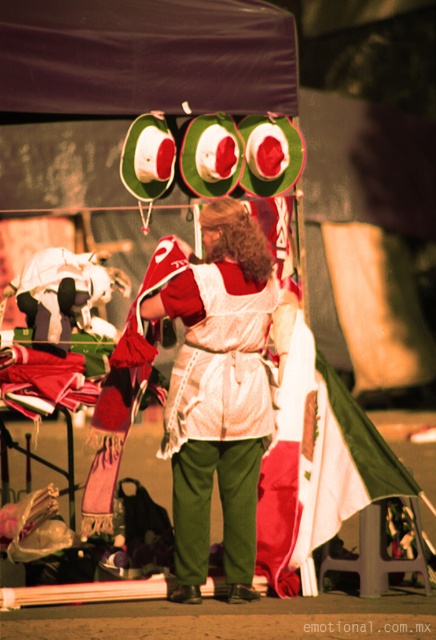
Between point (46, 10) and point (245, 518), which one is positioned behind?

The point (245, 518) is behind.

At what (x,y) coordinates should I click in order to perform the action: click on black fabric canopy at upper center. Please return your answer as a coordinate pair (x, y). Image resolution: width=436 pixels, height=640 pixels. Looking at the image, I should click on (146, 56).

Between point (19, 16) and point (230, 563), which one is positioned in front?

Point (19, 16) is more forward.

You are a GUI agent. You are given a task and a screenshot of the screen. Output one action in this format:
    pyautogui.click(x=<x>, y=<y>)
    Task: Click on the black fabric canopy at upper center
    The height and width of the screenshot is (640, 436).
    Given the screenshot: What is the action you would take?
    pyautogui.click(x=146, y=56)